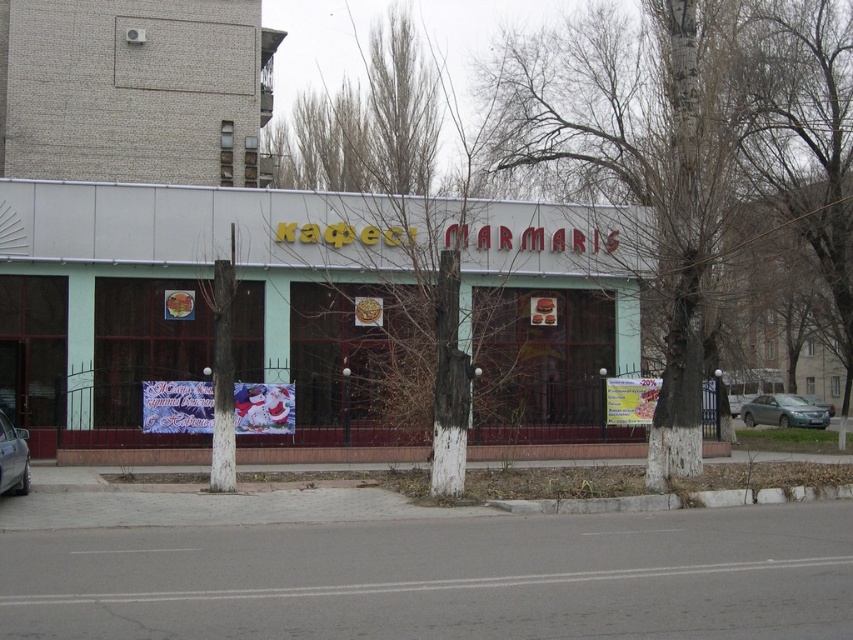
You are a delivery person who needs to park a new car that is 1.8 meters wide between the satin silver sedan at right and the silver metallic car at lower left. Based on the scene, can you determine if there is enough space between them to park your car?

The satin silver sedan at right might be wider than silver metallic car at lower left, so it is uncertain if there is enough space between them to park your car that is 1.8 meters wide. You should check the actual width of both cars first.

You are a delivery person who needs to park your vehicle in the space between the three small trees with white trunks and the cafe facade. The space is narrow. Given the vehicles present, which car among the satin silver sedan at right and the silver metallic car at lower left would have a better chance of fitting into the parking space without needing to adjust its position?

The silver metallic car at lower left has a better chance of fitting into the parking space because it is smaller than the satin silver sedan at right.

You are a delivery person who needs to park your 12 feet long truck between the satin silver sedan at right and the silver metallic sedan at center. Is there enough space between them to park your truck?

The distance between the satin silver sedan at right and the silver metallic sedan at center is 6.56 feet, which is shorter than the 12 feet length of your truck. Therefore, there is not enough space to park your truck between them.